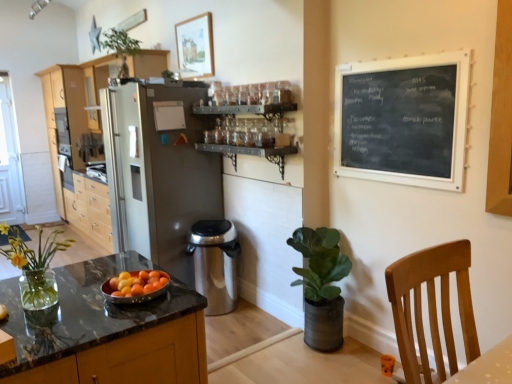
Describe the element at coordinates (34, 266) in the screenshot. I see `clear glass vase at lower left, which appears as the 2th houseplant when ordered from the bottom` at that location.

Describe the element at coordinates (403, 120) in the screenshot. The height and width of the screenshot is (384, 512). I see `black chalkboard at upper right` at that location.

You are a GUI agent. You are given a task and a screenshot of the screen. Output one action in this format:
    pyautogui.click(x=<x>, y=<y>)
    Task: Click on the satin silver refrigerator at center
    The width and height of the screenshot is (512, 384).
    Given the screenshot: What is the action you would take?
    pyautogui.click(x=158, y=173)

What is the approximate height of light brown wooden chair at lower right?

light brown wooden chair at lower right is 24.88 inches in height.

At what (x,y) coordinates should I click in order to perform the action: click on wooden picture frame at upper center. Please return your answer as a coordinate pair (x, y). The image size is (512, 384). Looking at the image, I should click on (195, 46).

What is the approximate height of silver metallic trash can at center?

silver metallic trash can at center is 27.71 inches in height.

Identify the location of clear glass vase at lower left, arranged as the second houseplant when viewed from the left. Image resolution: width=512 pixels, height=384 pixels. (34, 266).

The height and width of the screenshot is (384, 512). I want to click on bulletin board that appears above the light brown wood cabinets at left (from a real-world perspective), so click(x=403, y=120).

In terms of size, does black chalkboard at upper right appear bigger or smaller than light brown wood cabinets at left?

In the image, black chalkboard at upper right appears to be smaller than light brown wood cabinets at left.

Is black chalkboard at upper right further to the viewer compared to light brown wood cabinets at left?

No, black chalkboard at upper right is in front of light brown wood cabinets at left.

Is there a large distance between black chalkboard at upper right and light brown wood cabinets at left?

black chalkboard at upper right is positioned a significant distance from light brown wood cabinets at left.

From a real-world perspective, between green leafy plant at upper center, the 3th houseplant positioned from the bottom, and black chalkboard at upper right, who is vertically lower?

From a 3D spatial view, black chalkboard at upper right is below.

Is green leafy plant at upper center, the first houseplant in the back-to-front sequence, thinner than black chalkboard at upper right?

No.

In the image, is green leafy plant at upper center, the third houseplant viewed from the front, positioned in front of or behind black chalkboard at upper right?

Clearly, green leafy plant at upper center, the third houseplant viewed from the front, is behind black chalkboard at upper right.

Is green leafy plant at upper center, placed as the 3th houseplant when sorted from right to left, positioned far away from black chalkboard at upper right?

Yes, green leafy plant at upper center, placed as the 3th houseplant when sorted from right to left, and black chalkboard at upper right are located far from each other.

Does green leafy plant at upper center, the first houseplant in the back-to-front sequence, have a larger size compared to satin silver refrigerator at center?

No.

Find the location of `refrigerator that is on the right side of green leafy plant at upper center, the 3th houseplant positioned from the bottom`. refrigerator that is on the right side of green leafy plant at upper center, the 3th houseplant positioned from the bottom is located at coordinates (158, 173).

Which is more to the right, green leafy plant at upper center, which is counted as the first houseplant, starting from the top, or satin silver refrigerator at center?

From the viewer's perspective, satin silver refrigerator at center appears more on the right side.

How much distance is there between light brown wooden chair at lower right and green matte plant at lower right, which appears as the third houseplant when viewed from the top?

light brown wooden chair at lower right and green matte plant at lower right, which appears as the third houseplant when viewed from the top, are 1.27 meters apart from each other.

From the image's perspective, is light brown wooden chair at lower right positioned above or below green matte plant at lower right, marked as the 3th houseplant in a left-to-right arrangement?

Clearly, from the image's perspective, light brown wooden chair at lower right is above green matte plant at lower right, marked as the 3th houseplant in a left-to-right arrangement.

Which object is wider, light brown wooden chair at lower right or green matte plant at lower right, which appears as the third houseplant when viewed from the top?

Wider between the two is light brown wooden chair at lower right.

Looking at this image, is there a large distance between light brown wooden chair at lower right and green matte plant at lower right, the second houseplant from the front?

light brown wooden chair at lower right is far away from green matte plant at lower right, the second houseplant from the front.

Is metallic bowl of fruit at center aimed at clear glass vase at lower left, which appears as the 2th houseplant when ordered from the bottom?

No, metallic bowl of fruit at center is not aimed at clear glass vase at lower left, which appears as the 2th houseplant when ordered from the bottom.

From a real-world perspective, which is physically above, metallic bowl of fruit at center or clear glass vase at lower left, acting as the 2th houseplant starting from the top?

clear glass vase at lower left, acting as the 2th houseplant starting from the top, from a real-world perspective.

Which is behind, point (108, 290) or point (33, 279)?

The point (108, 290) is farther.

How many degrees apart are the facing directions of metallic bowl of fruit at center and clear glass vase at lower left, acting as the 2th houseplant starting from the top?

The facing directions of metallic bowl of fruit at center and clear glass vase at lower left, acting as the 2th houseplant starting from the top, are 2.99 degrees apart.

From the image's perspective, is silver metallic trash can at center located above metallic bowl of fruit at center?

Incorrect, from the image's perspective, silver metallic trash can at center is lower than metallic bowl of fruit at center.

Considering the positions of objects silver metallic trash can at center and metallic bowl of fruit at center in the image provided, who is more to the left, silver metallic trash can at center or metallic bowl of fruit at center?

metallic bowl of fruit at center is more to the left.

In order to click on appliance that is behind the metallic bowl of fruit at center in this screenshot , I will do `click(215, 263)`.

Between green matte plant at lower right, arranged as the second houseplant when viewed from the back, and light brown wooden chair at lower right, which one has smaller width?

green matte plant at lower right, arranged as the second houseplant when viewed from the back.

Can you confirm if green matte plant at lower right, arranged as the 1th houseplant when viewed from the right, is positioned to the left of light brown wooden chair at lower right?

Correct, you'll find green matte plant at lower right, arranged as the 1th houseplant when viewed from the right, to the left of light brown wooden chair at lower right.

Is green matte plant at lower right, the second houseplant from the front, oriented away from light brown wooden chair at lower right?

green matte plant at lower right, the second houseplant from the front, is not turned away from light brown wooden chair at lower right.

Relative to light brown wooden chair at lower right, is green matte plant at lower right, arranged as the 1th houseplant when viewed from the right, in front or behind?

In the image, green matte plant at lower right, arranged as the 1th houseplant when viewed from the right, appears behind light brown wooden chair at lower right.

I want to click on cabinetry below the black chalkboard at upper right (from a real-world perspective), so click(x=76, y=99).

The width and height of the screenshot is (512, 384). In order to click on bulletin board on the right of the green leafy plant at upper center, which is counted as the first houseplant, starting from the top in this screenshot , I will do `click(403, 120)`.

Which object lies nearer to the anchor point satin silver refrigerator at center, white painted wood screen door at left or light brown wood cabinets at left?

light brown wood cabinets at left is closer to satin silver refrigerator at center.

Looking at the image, which one is located further to light brown wood cabinets at left, silver metallic trash can at center or metallic bowl of fruit at center?

metallic bowl of fruit at center is further to light brown wood cabinets at left.

Considering their positions, is wooden picture frame at upper center positioned further to light brown wood cabinets at left than silver metallic trash can at center?

silver metallic trash can at center is further to light brown wood cabinets at left.

Which object lies nearer to the anchor point marble countertop at lower left, green leafy plant at upper center, the 3th houseplant positioned from the bottom, or black chalkboard at upper right?

black chalkboard at upper right.

Looking at the image, which one is located further to white painted wood screen door at left, silver metallic trash can at center or green matte plant at lower right, positioned as the 1th houseplant in bottom-to-top order?

The object further to white painted wood screen door at left is green matte plant at lower right, positioned as the 1th houseplant in bottom-to-top order.

Looking at the image, which one is located closer to satin silver refrigerator at center, light brown wood cabinets at left or light brown wooden chair at lower right?

Based on the image, light brown wood cabinets at left appears to be nearer to satin silver refrigerator at center.

When comparing their distances from marble countertop at lower left, does green matte plant at lower right, arranged as the 1th houseplant when viewed from the right, or metallic bowl of fruit at center seem closer?

metallic bowl of fruit at center is closer to marble countertop at lower left.

Considering their positions, is satin silver refrigerator at center positioned closer to marble countertop at lower left than green matte plant at lower right, marked as the 3th houseplant in a left-to-right arrangement?

The object closer to marble countertop at lower left is green matte plant at lower right, marked as the 3th houseplant in a left-to-right arrangement.

The height and width of the screenshot is (384, 512). What are the coordinates of `countertop between satin silver refrigerator at center and black chalkboard at upper right in the horizontal direction` in the screenshot? It's located at (104, 325).

This screenshot has width=512, height=384. I want to click on picture frame located between light brown wooden chair at lower right and green leafy plant at upper center, which is counted as the first houseplant, starting from the top, in the depth direction, so click(x=195, y=46).

Where is `appliance between marble countertop at lower left and light brown wood cabinets at left along the z-axis`? The height and width of the screenshot is (384, 512). appliance between marble countertop at lower left and light brown wood cabinets at left along the z-axis is located at coordinates (215, 263).

Image resolution: width=512 pixels, height=384 pixels. In order to click on bulletin board between light brown wooden chair at lower right and satin silver refrigerator at center in the front-back direction in this screenshot , I will do `click(403, 120)`.